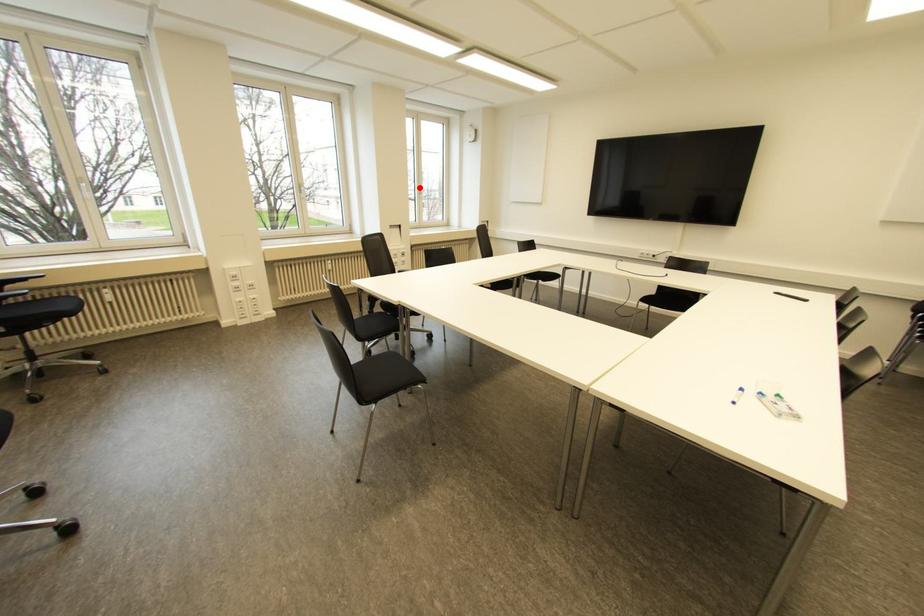
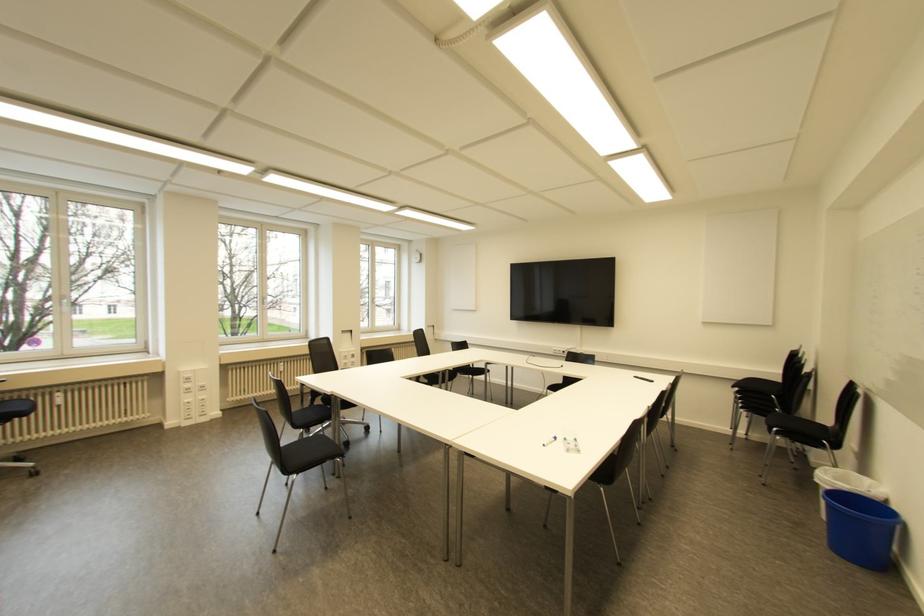
The point at the highlighted location is marked in the first image. Where is the corresponding point in the second image?

(372, 299)